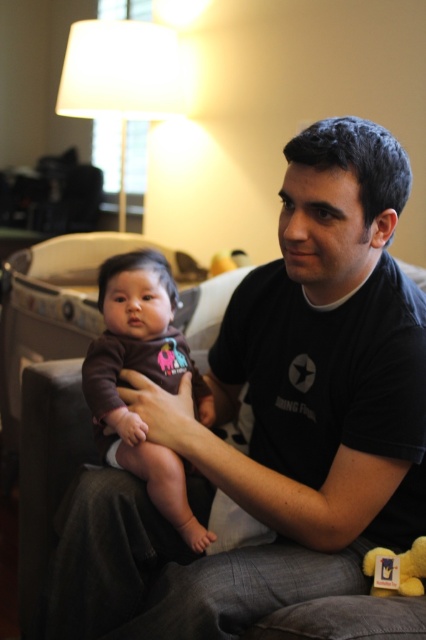
Question: Is brown soft fabric baby at center wider than white fabric lampshade at upper center?

Choices:
 (A) no
 (B) yes

Answer: (A)

Question: Among these objects, which one is farthest from the camera?

Choices:
 (A) black cotton shirt at center
 (B) white fabric lampshade at upper center
 (C) brown soft fabric baby at center

Answer: (B)

Question: Estimate the real-world distances between objects in this image. Which object is closer to the yellow plush bear at lower right?

Choices:
 (A) white fabric lampshade at upper center
 (B) brown soft fabric baby at center

Answer: (B)

Question: Is white fabric lampshade at upper center bigger than yellow plush bear at lower right?

Choices:
 (A) yes
 (B) no

Answer: (A)

Question: Can you confirm if black cotton shirt at center is thinner than yellow plush bear at lower right?

Choices:
 (A) yes
 (B) no

Answer: (B)

Question: Which point appears farthest from the camera in this image?

Choices:
 (A) (354, 561)
 (B) (163, 44)
 (C) (141, 340)
 (D) (408, 561)

Answer: (B)